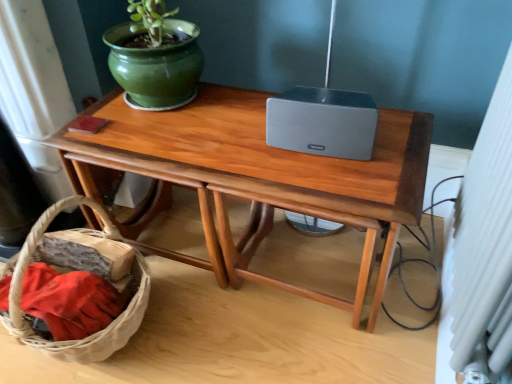
Question: Is green glossy flowerpot at upper left positioned far away from wooden table at center?

Choices:
 (A) yes
 (B) no

Answer: (B)

Question: Is wooden table at center completely or partially inside green glossy flowerpot at upper left?

Choices:
 (A) yes
 (B) no

Answer: (B)

Question: Is green glossy flowerpot at upper left outside wooden table at center?

Choices:
 (A) yes
 (B) no

Answer: (A)

Question: Is green glossy flowerpot at upper left taller than wooden table at center?

Choices:
 (A) no
 (B) yes

Answer: (A)

Question: From a real-world perspective, is green glossy flowerpot at upper left physically above wooden table at center?

Choices:
 (A) yes
 (B) no

Answer: (A)

Question: From a real-world perspective, relative to green glossy flowerpot at upper left, is woven brown basket at lower left vertically above or below?

Choices:
 (A) above
 (B) below

Answer: (B)

Question: Considering their positions, is woven brown basket at lower left located in front of or behind green glossy flowerpot at upper left?

Choices:
 (A) front
 (B) behind

Answer: (A)

Question: Looking at their shapes, would you say woven brown basket at lower left is wider or thinner than green glossy flowerpot at upper left?

Choices:
 (A) thin
 (B) wide

Answer: (B)

Question: Is point (75, 200) positioned closer to the camera than point (195, 41)?

Choices:
 (A) closer
 (B) farther

Answer: (A)

Question: Is green glossy flowerpot at upper left taller or shorter than woven brown basket at lower left?

Choices:
 (A) tall
 (B) short

Answer: (B)

Question: In the image, is green glossy flowerpot at upper left on the left side or the right side of woven brown basket at lower left?

Choices:
 (A) right
 (B) left

Answer: (A)

Question: From a real-world perspective, is green glossy flowerpot at upper left physically located above or below woven brown basket at lower left?

Choices:
 (A) below
 (B) above

Answer: (B)

Question: In the image, is green glossy flowerpot at upper left positioned in front of or behind woven brown basket at lower left?

Choices:
 (A) behind
 (B) front

Answer: (A)

Question: Do you think woven brown basket at lower left is within wooden table at center, or outside of it?

Choices:
 (A) inside
 (B) outside

Answer: (B)

Question: Is woven brown basket at lower left to the left or to the right of wooden table at center in the image?

Choices:
 (A) right
 (B) left

Answer: (B)